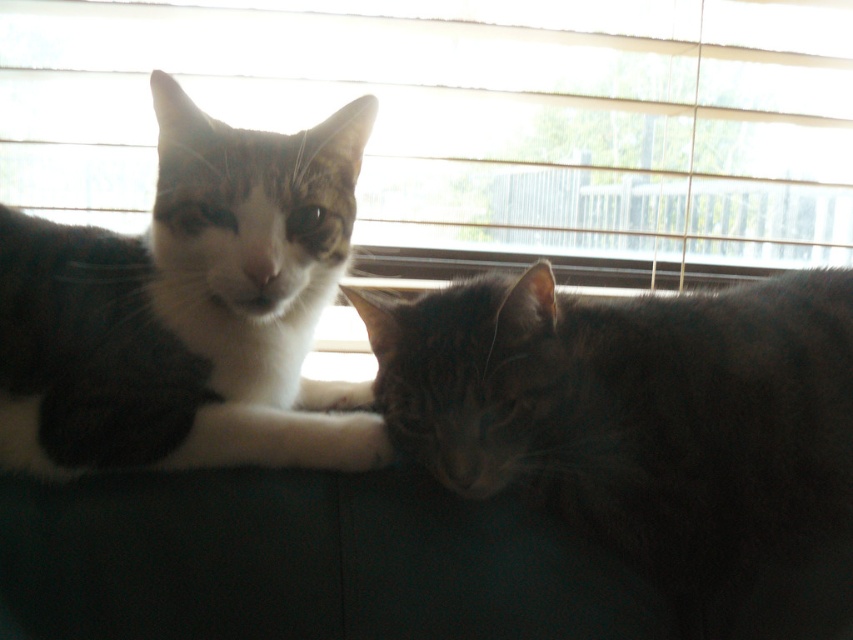
Question: Among these objects, which one is nearest to the camera?

Choices:
 (A) dark gray fur cat at center
 (B) white fur cat at left
 (C) white wood blinds at upper center

Answer: (A)

Question: Is dark gray fur cat at center closer to the viewer compared to white fur cat at left?

Choices:
 (A) no
 (B) yes

Answer: (B)

Question: Is dark gray fur cat at center wider than white fur cat at left?

Choices:
 (A) no
 (B) yes

Answer: (B)

Question: Which object appears closest to the camera in this image?

Choices:
 (A) dark gray fur cat at center
 (B) white fur cat at left
 (C) white wood blinds at upper center

Answer: (A)

Question: Is white wood blinds at upper center thinner than white fur cat at left?

Choices:
 (A) yes
 (B) no

Answer: (B)

Question: Which object is the closest to the white wood blinds at upper center?

Choices:
 (A) dark gray fur cat at center
 (B) white fur cat at left

Answer: (B)